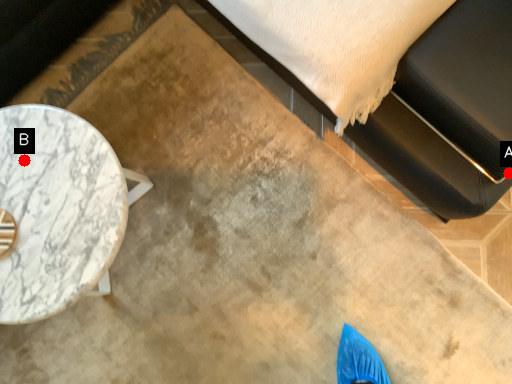
Question: Two points are circled on the image, labeled by A and B beside each circle. Among these points, which one is farthest from the camera?

Choices:
 (A) A is further
 (B) B is further

Answer: (A)